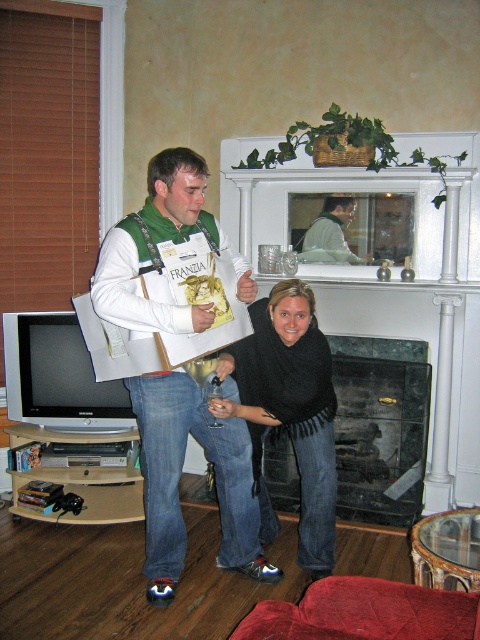
You are standing in the living room and want to place a decorative item on the green marble fireplace at upper center. What are the coordinates where you should place it?

The green marble fireplace at upper center is located at coordinates point (391, 278).

Based on the scene described, which fireplace is bigger between the green marble fireplace at upper center and the black marble fireplace at center?

The green marble fireplace at upper center is larger in size compared to the black marble fireplace at center.